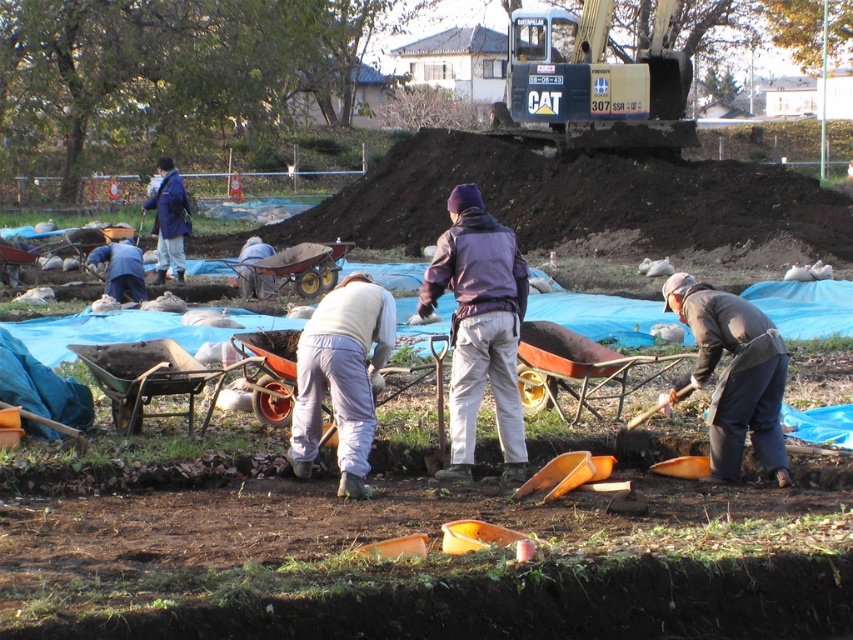
You are a worker at the construction site and need to move the light blue fabric at center to the other side of the yellow metal wheelbarrow at center. Can you do this without moving the wheelbarrow first?

The yellow metal wheelbarrow at center is closer to the viewer than the light blue fabric at center, so you can move the light blue fabric at center to the other side of the yellow metal wheelbarrow at center without moving the wheelbarrow first because the fabric is farther away and can be accessed around the wheelbarrow.

You are a construction worker who needs to place a 1.2 meter tall box on the site. Given the yellow metal wheelbarrow at center and the light blue fabric at center, which one can support the height of the box?

The light blue fabric at center is taller than the yellow metal wheelbarrow at center, so the light blue fabric at center can support the 1.2 meter tall box.

You are standing at the point marked as point (341, 376) on the gray cotton pants at center. Which direction should you move to reach the nearest orange plastic container?

The point (341, 376) is on the gray cotton pants at center. Since the orange plastic containers are scattered around the site, you would need to move towards the nearest one based on their locations. However, without specific coordinates for the containers, the exact direction cannot be determined.